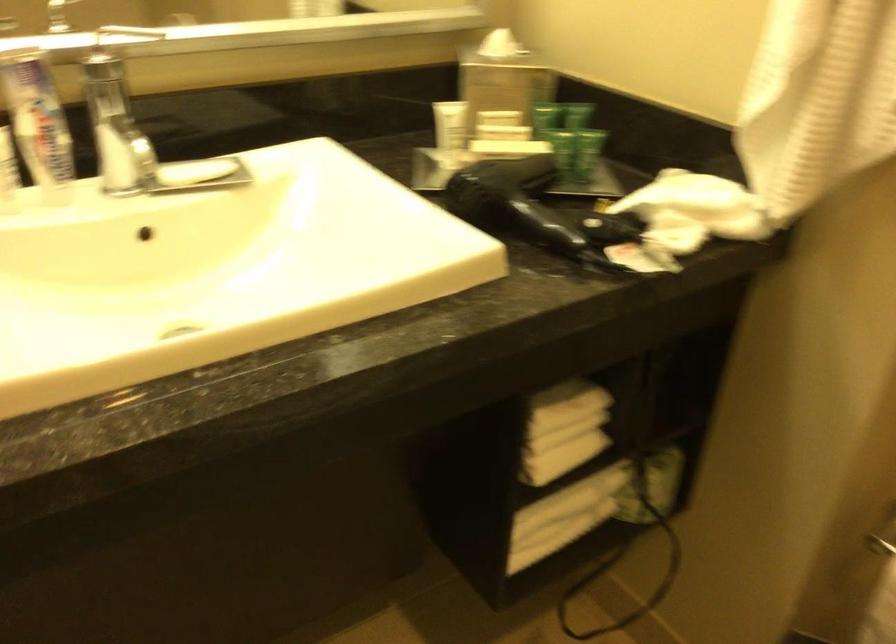
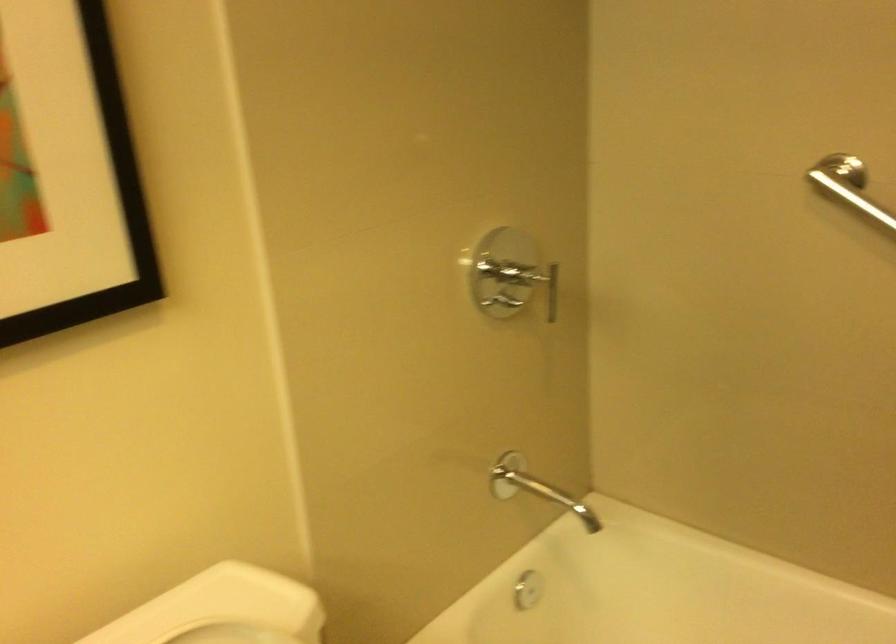
The images are taken continuously from a first-person perspective. In which direction is your viewpoint rotating?

The rotation direction of the camera is right-down.